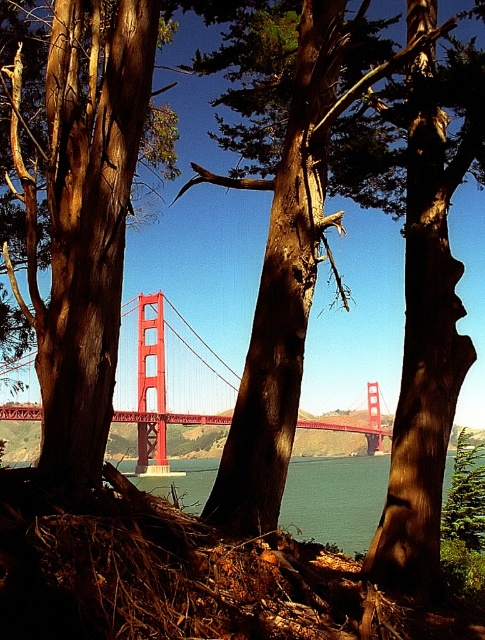
This screenshot has width=485, height=640. Describe the element at coordinates (85, 220) in the screenshot. I see `smooth brown tree trunk at center` at that location.

Looking at this image, is smooth brown tree trunk at center to the left of transparent water at center from the viewer's perspective?

Correct, you'll find smooth brown tree trunk at center to the left of transparent water at center.

Identify the location of smooth brown tree trunk at center. (85, 220).

Where is `smooth brown tree trunk at center`? smooth brown tree trunk at center is located at coordinates (85, 220).

Between red painted steel bridge at center and transparent water at center, which one appears on the right side from the viewer's perspective?

transparent water at center is more to the right.

Which is behind, point (22, 406) or point (362, 540)?

Positioned behind is point (22, 406).

Identify the location of red painted steel bridge at center. (166, 385).

Which is below, smooth brown tree trunk at center or red painted steel bridge at center?

Positioned lower is red painted steel bridge at center.

Who is higher up, smooth brown tree trunk at center or red painted steel bridge at center?

Positioned higher is smooth brown tree trunk at center.

Identify the location of smooth brown tree trunk at center. This screenshot has width=485, height=640. tap(85, 220).

This screenshot has height=640, width=485. Identify the location of smooth brown tree trunk at center. (85, 220).